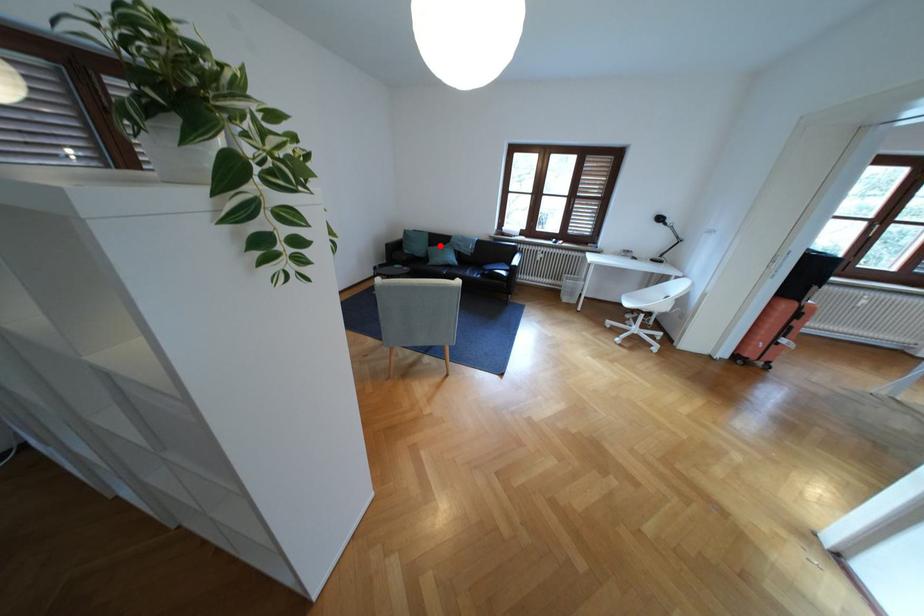
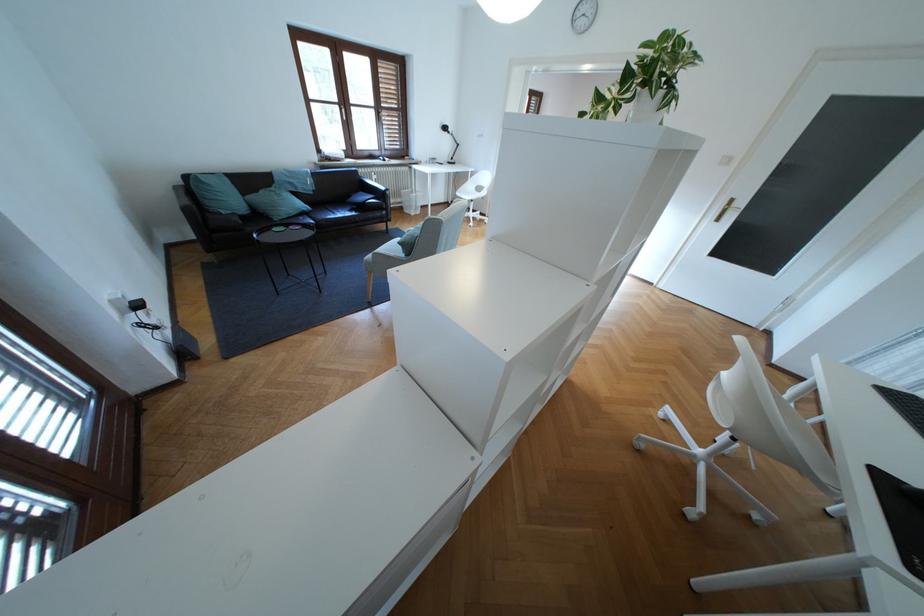
Find the pixel in the second image that matches the highlighted location in the first image.

(253, 193)